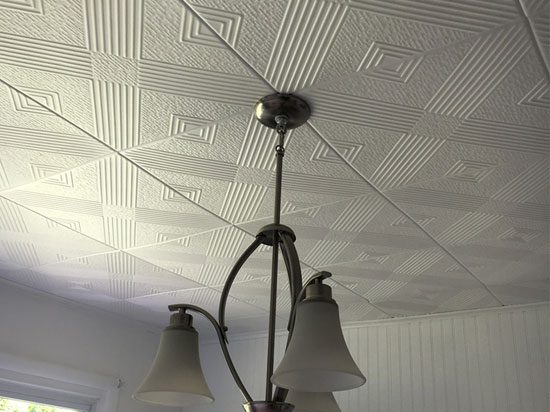
Locate an element on the screen. This screenshot has height=412, width=550. ceiling is located at coordinates (300, 54).